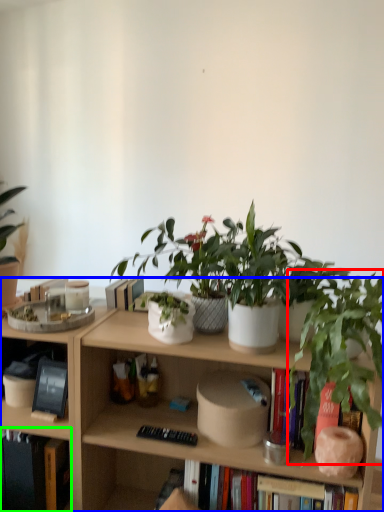
Question: Based on their relative distances, which object is nearer to houseplant (highlighted by a red box)? Choose from bookcase (highlighted by a blue box) and book (highlighted by a green box).

Choices:
 (A) bookcase
 (B) book

Answer: (A)